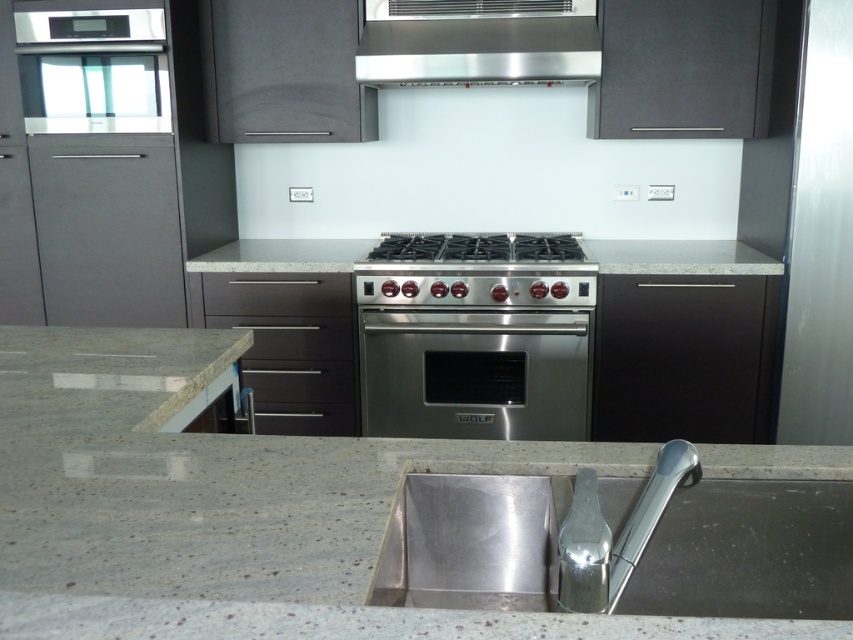
You are a plumber inspecting the kitchen. You need to locate the main water valve for the satin nickel faucet at lower center. Since the valve is typically placed behind the stainless steel sink at center, can you reach it without moving the sink?

The stainless steel sink at center is positioned on the right side of the satin nickel faucet at lower center, meaning the valve behind the sink would be accessible from the right side of the faucet. Therefore, you can reach the valve without moving the sink.

You are standing in the kitchen and want to reach both the point at coordinates point (532,472) and point (596,609). Which point will you reach first?

You will reach point (532,472) first because it is closer to you than point (596,609), which is further away.

What is located at the coordinates point (474, 372) in the image?

The stainless steel oven at center is located at point (474, 372).